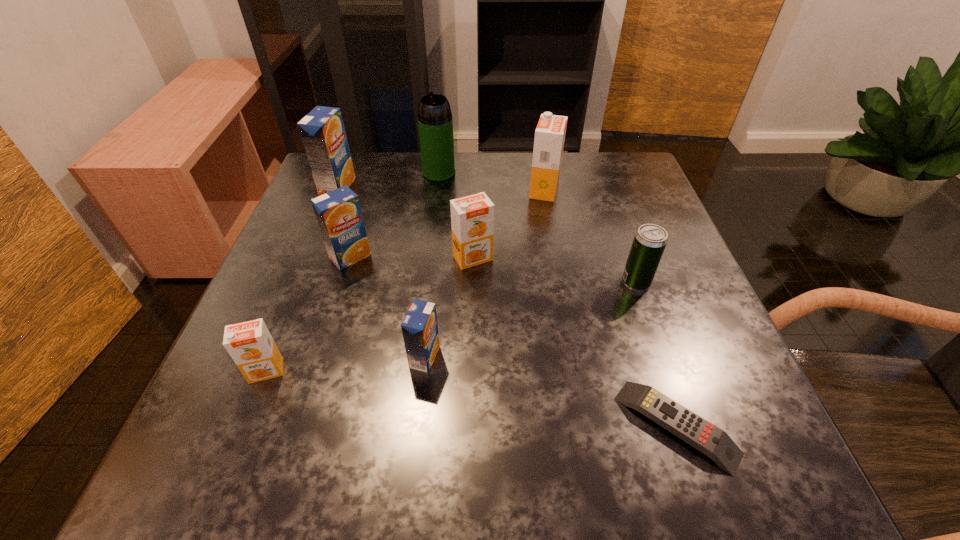
Find the location of a particular element. The image size is (960, 540). vacant space positioned on the front of the second blue orange_juice from left to right is located at coordinates (322, 350).

This screenshot has width=960, height=540. I want to click on free space located 0.150m on the left of the second orange orange juice from left to right, so click(378, 258).

At what (x,y) coordinates should I click in order to perform the action: click on vacant space located 0.360m on the back of the sixth farthest object. Please return your answer as a coordinate pair (x, y). Looking at the image, I should click on (598, 173).

Locate an element on the screen. This screenshot has height=540, width=960. vacant space situated on the back of the nearest blue orange_juice is located at coordinates (441, 210).

Locate an element on the screen. Image resolution: width=960 pixels, height=540 pixels. free spot located on the front of the nearest orange orange juice is located at coordinates (230, 461).

Locate an element on the screen. Image resolution: width=960 pixels, height=540 pixels. vacant space situated on the left of the remote control is located at coordinates (385, 426).

The height and width of the screenshot is (540, 960). Identify the location of thermos bottle at the far edge. (435, 122).

This screenshot has width=960, height=540. I want to click on object that is at the near edge, so click(x=715, y=443).

This screenshot has width=960, height=540. Find the location of `beer can that is at the right edge`. beer can that is at the right edge is located at coordinates (650, 240).

Where is `remote control at the right edge`? Image resolution: width=960 pixels, height=540 pixels. remote control at the right edge is located at coordinates (715, 443).